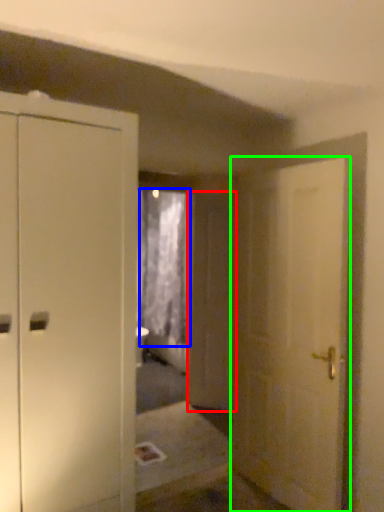
Question: Which is farther away from screen door (highlighted by a red box)? curtain (highlighted by a blue box) or door (highlighted by a green box)?

Choices:
 (A) curtain
 (B) door

Answer: (A)